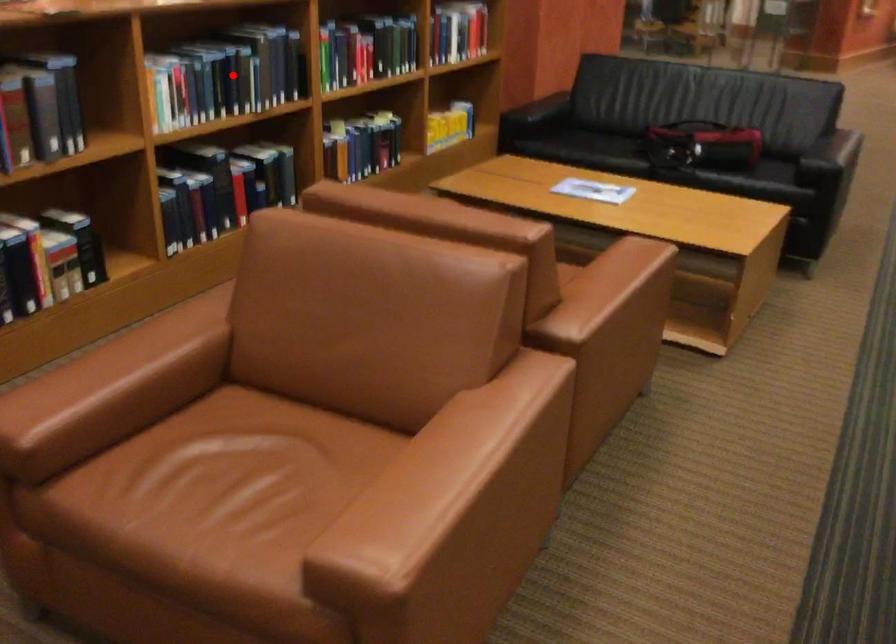
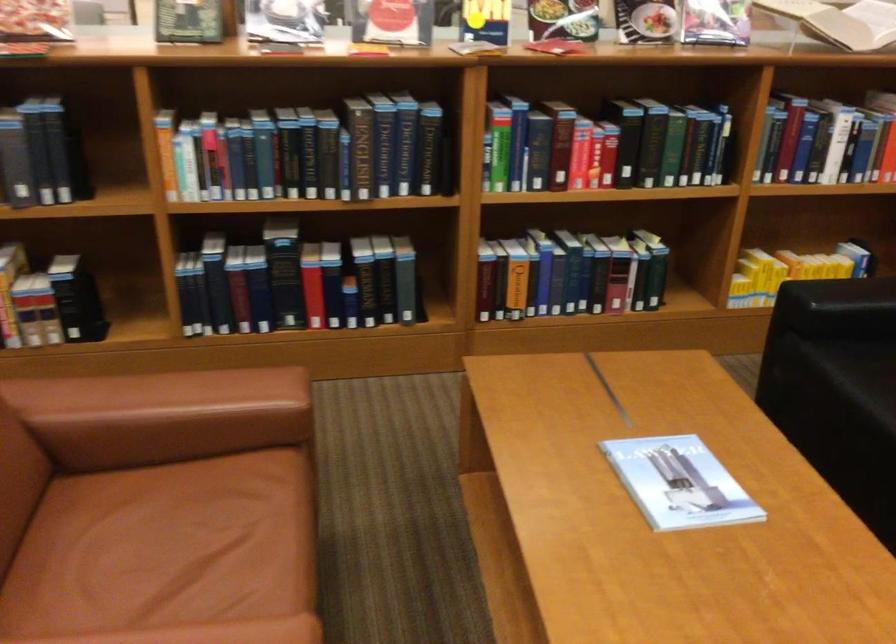
Find the pixel in the second image that matches the highlighted location in the first image.

(306, 152)